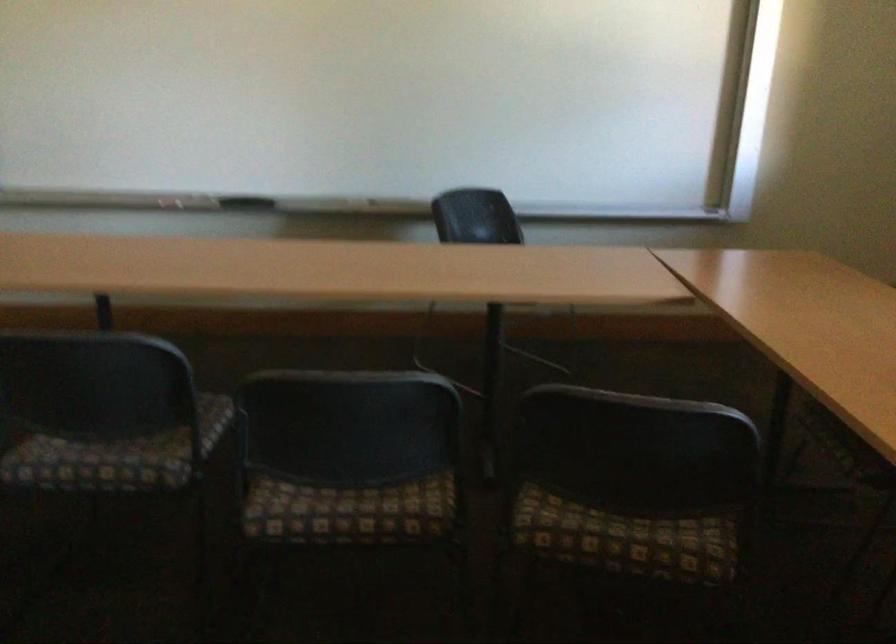
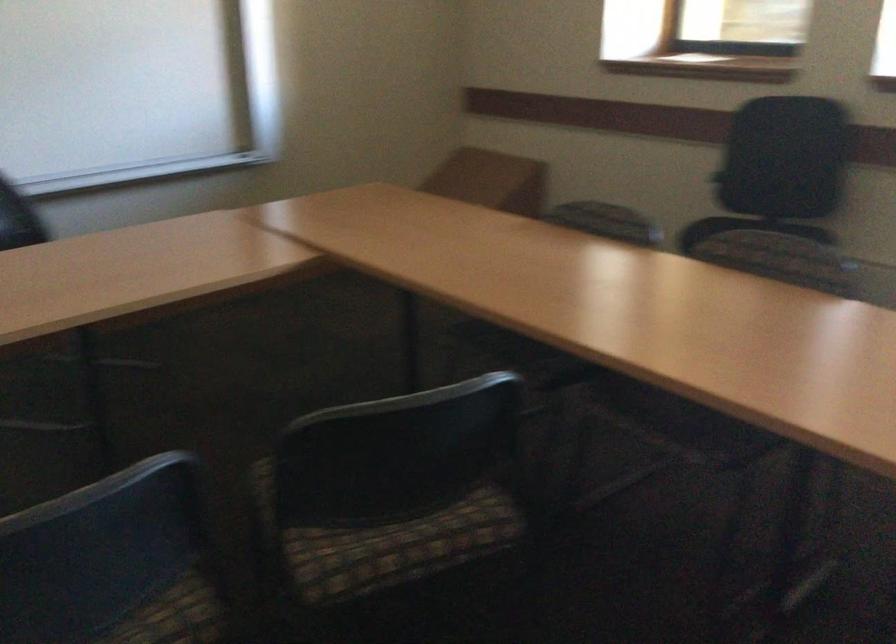
Locate, in the second image, the point that corresponds to pixel 375 480 in the first image.

(117, 608)